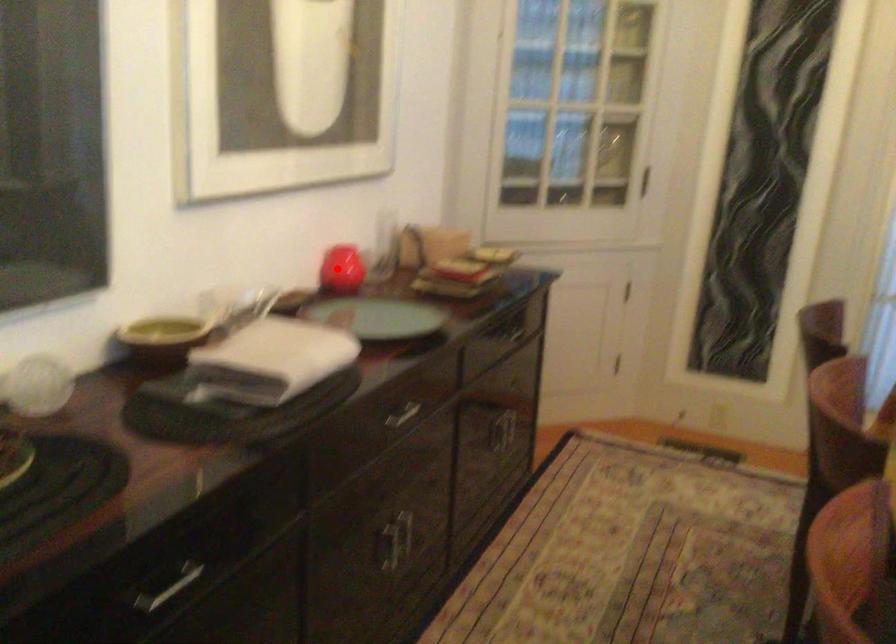
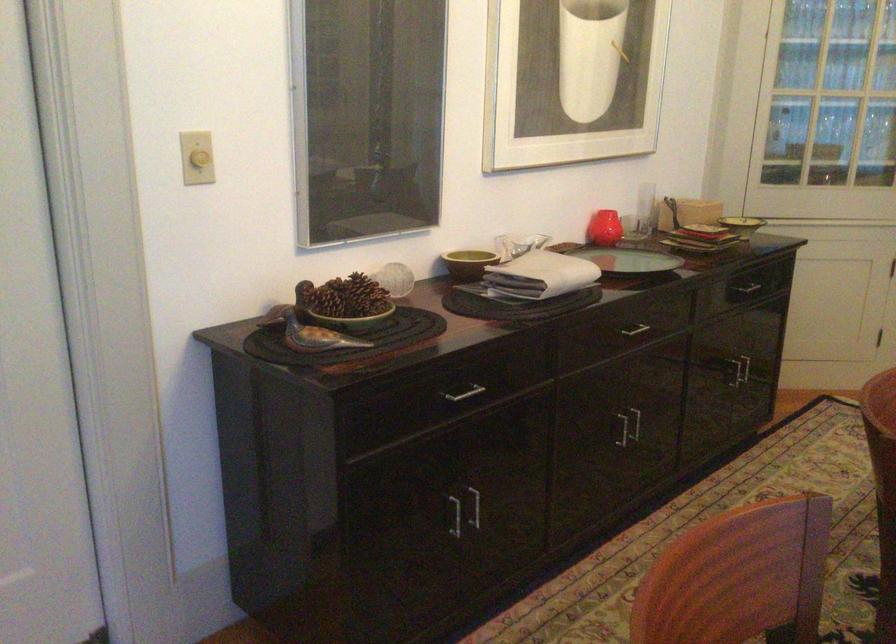
Question: I am providing you with two images of the same scene from different viewpoints. Given a red point in image1, look at the same physical point in image2. Is it:

Choices:
 (A) Closer to the viewpoint
 (B) Farther from the viewpoint

Answer: (B)